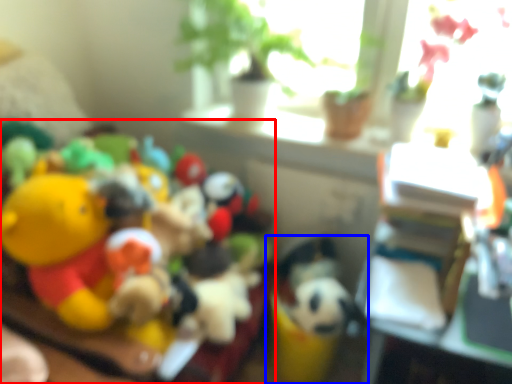
Question: Which point is further to the camera, toy (highlighted by a red box) or toy (highlighted by a blue box)?

Choices:
 (A) toy
 (B) toy

Answer: (B)